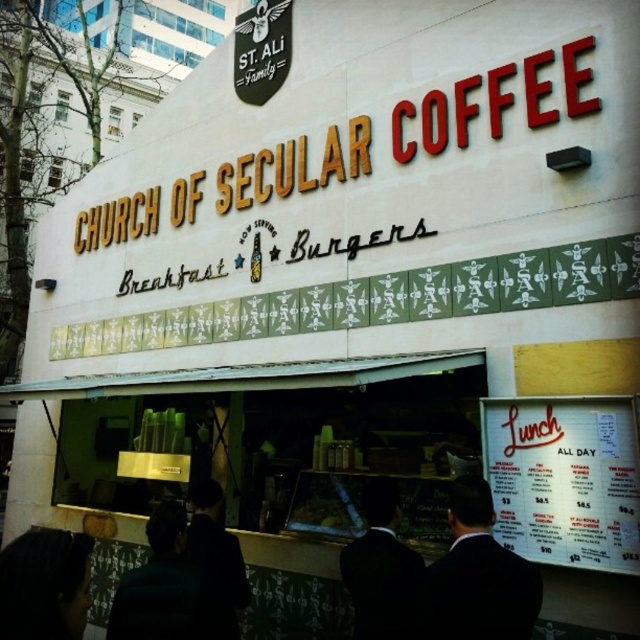
Question: Can you confirm if white paper menu at lower right is positioned below dark brown hair at lower left?

Choices:
 (A) yes
 (B) no

Answer: (B)

Question: Does dark suit at center have a greater width compared to dark brown hair at lower left?

Choices:
 (A) no
 (B) yes

Answer: (A)

Question: Which object appears closest to the camera in this image?

Choices:
 (A) dark brown leather jacket at lower left
 (B) dark brown hair at lower left

Answer: (B)

Question: Which point is farther from the camera taking this photo?

Choices:
 (A) (380, 564)
 (B) (90, 561)
 (C) (630, 536)

Answer: (A)

Question: Can you confirm if black suit at center is positioned above dark fabric jacket at center?

Choices:
 (A) no
 (B) yes

Answer: (B)

Question: Which object appears closest to the camera in this image?

Choices:
 (A) black suit at center
 (B) white paper menu at lower right
 (C) dark suit at center
 (D) dark brown leather jacket at lower left

Answer: (C)